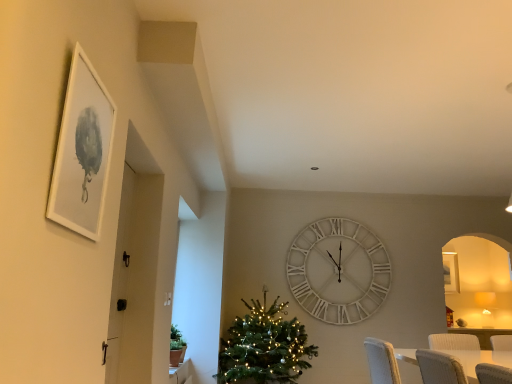
The image size is (512, 384). What do you see at coordinates (338, 271) in the screenshot? I see `white wooden clock at center` at bounding box center [338, 271].

The width and height of the screenshot is (512, 384). What are the coordinates of `white wooden clock at center` in the screenshot? It's located at coord(338,271).

What is the approximate width of white matte picture frame at upper left?

It is 0.90 inches.

Measure the distance between green matte christmas tree at center and camera.

green matte christmas tree at center and camera are 3.83 meters apart from each other.

You are a GUI agent. You are given a task and a screenshot of the screen. Output one action in this format:
    pyautogui.click(x=<x>, y=<y>)
    Task: Click on the white wooden clock at center
    Image resolution: width=512 pixels, height=384 pixels.
    Given the screenshot: What is the action you would take?
    pyautogui.click(x=338, y=271)

Considering the positions of objects white wooden clock at center and green matte christmas tree at center in the image provided, who is in front, white wooden clock at center or green matte christmas tree at center?

green matte christmas tree at center is more forward.

Which of these two, white wooden clock at center or green matte christmas tree at center, stands shorter?

green matte christmas tree at center is shorter.

Is white wooden clock at center aimed at green matte christmas tree at center?

No, white wooden clock at center is not turned towards green matte christmas tree at center.

Do you think white wooden clock at center is within green matte christmas tree at center, or outside of it?

white wooden clock at center is not enclosed by green matte christmas tree at center.

How different are the orientations of white matte picture frame at upper left and white wooden clock at center in degrees?

white matte picture frame at upper left and white wooden clock at center are facing 90.8 degrees away from each other.

Is white matte picture frame at upper left next to white wooden clock at center?

white matte picture frame at upper left is not next to white wooden clock at center, and they're not touching.

Where is `picture frame in front of the white wooden clock at center`? picture frame in front of the white wooden clock at center is located at coordinates (82, 151).

From a real-world perspective, is white matte picture frame at upper left above or below white wooden clock at center?

white matte picture frame at upper left is situated higher than white wooden clock at center in the real world.

Is white matte picture frame at upper left not within green matte christmas tree at center?

Absolutely, white matte picture frame at upper left is external to green matte christmas tree at center.

Consider the image. Is white matte picture frame at upper left oriented away from green matte christmas tree at center?

white matte picture frame at upper left does not have its back to green matte christmas tree at center.

Is white matte picture frame at upper left placed right next to green matte christmas tree at center?

No, white matte picture frame at upper left is not with green matte christmas tree at center.

From their relative heights in the image, would you say green matte christmas tree at center is taller or shorter than white wooden clock at center?

In the image, green matte christmas tree at center appears to be shorter than white wooden clock at center.

Relative to white wooden clock at center, is green matte christmas tree at center in front or behind?

green matte christmas tree at center is positioned closer to the viewer than white wooden clock at center.

From the picture: Between green matte christmas tree at center and white wooden clock at center, which one appears on the left side from the viewer's perspective?

green matte christmas tree at center is more to the left.

From the image's perspective, is green matte christmas tree at center under white wooden clock at center?

Correct, green matte christmas tree at center appears lower than white wooden clock at center in the image.

Does point (302, 271) come farther from viewer compared to point (62, 152)?

That is True.

In the scene shown: From the image's perspective, who appears lower, white wooden clock at center or white matte picture frame at upper left?

white wooden clock at center, from the image's perspective.

How different are the orientations of white wooden clock at center and white matte picture frame at upper left in degrees?

90.8 degrees.

How distant is white wooden clock at center from white matte picture frame at upper left?

white wooden clock at center is 4.04 meters from white matte picture frame at upper left.

Measure the distance between green matte christmas tree at center and white matte picture frame at upper left.

green matte christmas tree at center is 2.96 meters from white matte picture frame at upper left.

Who is bigger, green matte christmas tree at center or white matte picture frame at upper left?

green matte christmas tree at center.

Between green matte christmas tree at center and white matte picture frame at upper left, which one appears on the right side from the viewer's perspective?

green matte christmas tree at center.

From the image's perspective, is green matte christmas tree at center positioned above or below white matte picture frame at upper left?

Based on their image positions, green matte christmas tree at center is located beneath white matte picture frame at upper left.

Locate an element on the screen. Image resolution: width=512 pixels, height=384 pixels. wall clock on the right side of green matte christmas tree at center is located at coordinates (338, 271).

I want to click on picture frame above the white wooden clock at center (from the image's perspective), so click(x=82, y=151).

Considering their positions, is white wooden clock at center positioned further to green matte christmas tree at center than white matte picture frame at upper left?

white matte picture frame at upper left lies further to green matte christmas tree at center than the other object.

Estimate the real-world distances between objects in this image. Which object is closer to green matte christmas tree at center, white matte picture frame at upper left or white wooden clock at center?

white wooden clock at center.

Looking at the image, which one is located further to white wooden clock at center, green matte christmas tree at center or white matte picture frame at upper left?

The object further to white wooden clock at center is white matte picture frame at upper left.

Which object lies nearer to the anchor point white matte picture frame at upper left, green matte christmas tree at center or white wooden clock at center?

green matte christmas tree at center.

Which object lies nearer to the anchor point white matte picture frame at upper left, white wooden clock at center or green matte christmas tree at center?

Based on the image, green matte christmas tree at center appears to be nearer to white matte picture frame at upper left.

From the image, which object appears to be nearer to white wooden clock at center, white matte picture frame at upper left or green matte christmas tree at center?

green matte christmas tree at center is closer to white wooden clock at center.

Locate an element on the screen. The image size is (512, 384). christmas tree located between white matte picture frame at upper left and white wooden clock at center in the depth direction is located at coordinates (264, 346).